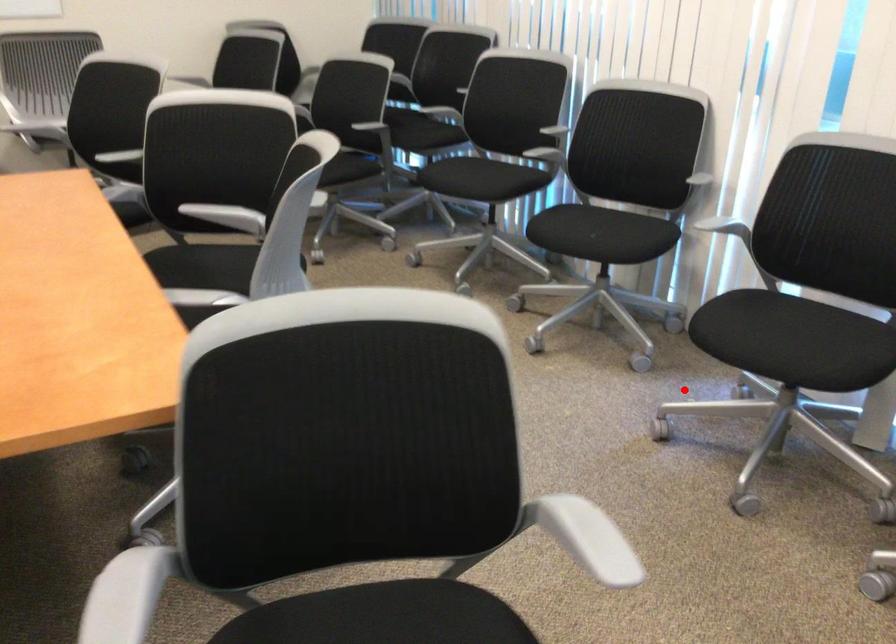
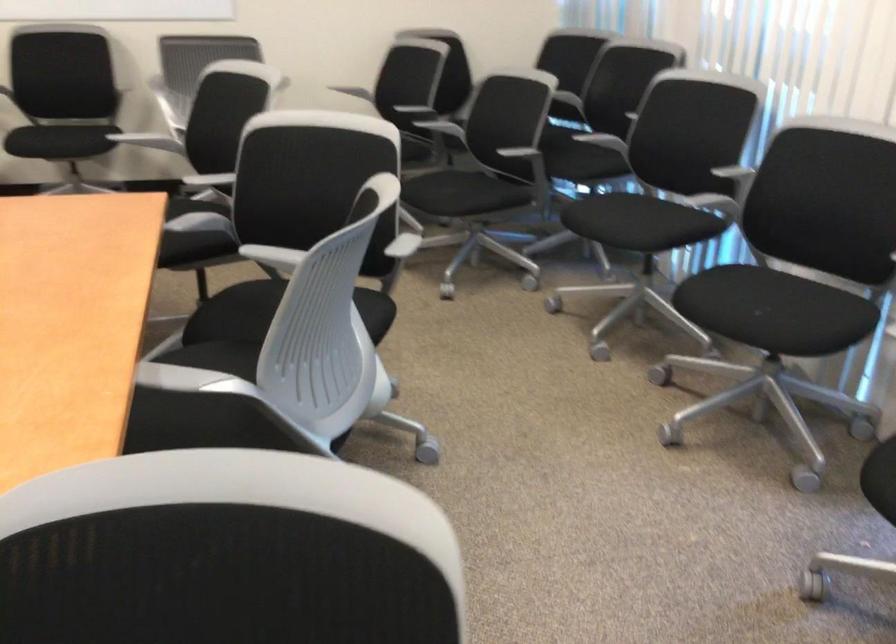
Question: I am providing you with two images of the same scene from different viewpoints. Given a red point in image1, look at the same physical point in image2. Is it:

Choices:
 (A) Closer to the viewpoint
 (B) Farther from the viewpoint

Answer: (A)